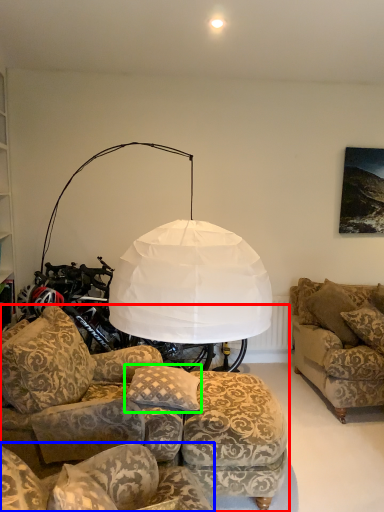
Question: Estimate the real-world distances between objects in this image. Which object is closer to studio couch (highlighted by a red box), studio couch (highlighted by a blue box) or pillow (highlighted by a green box)?

Choices:
 (A) studio couch
 (B) pillow

Answer: (B)